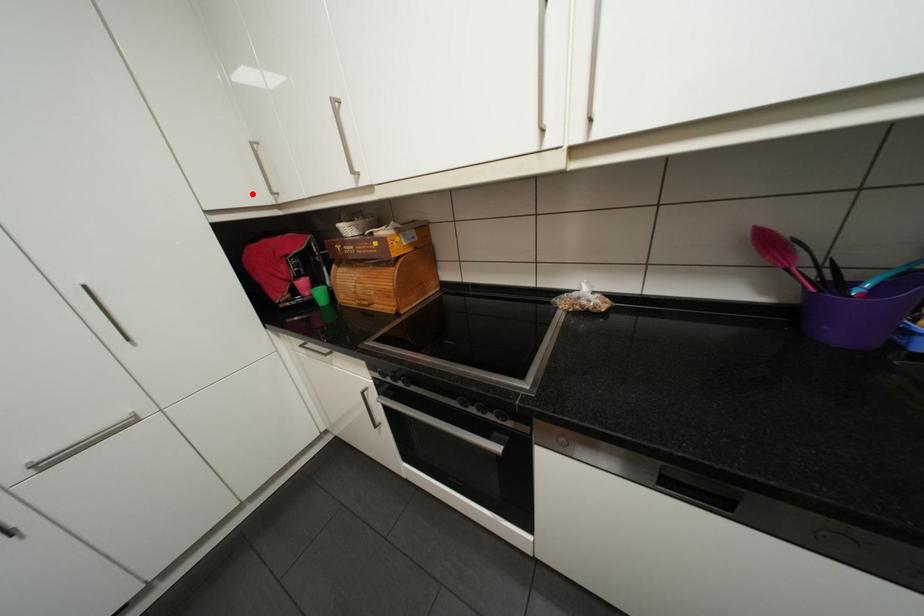
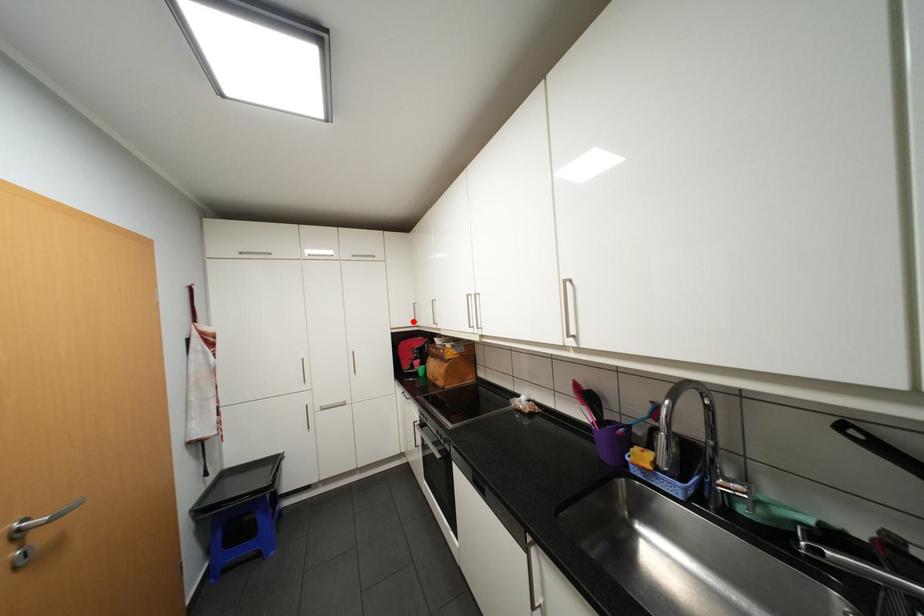
I am providing you with two images of the same scene from different viewpoints. A red point is marked on the first image and another point is marked on the second image. Is the marked point in image1 the same physical position as the marked point in image2?

A: Yes